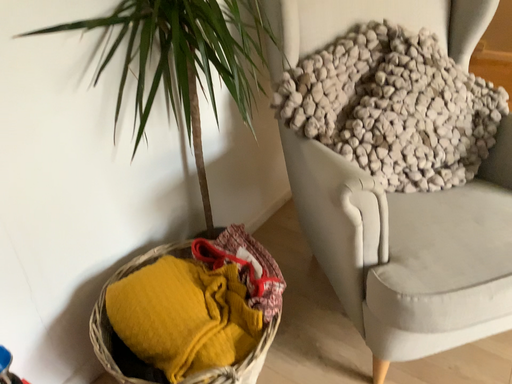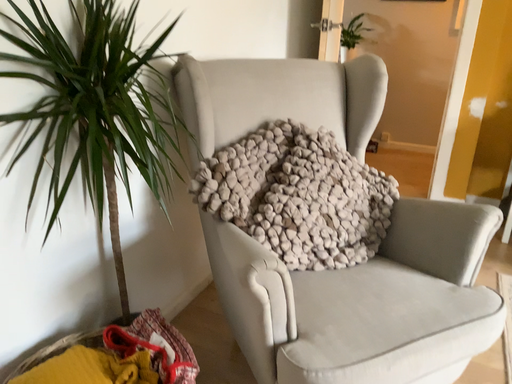
Question: Which way did the camera rotate in the video?

Choices:
 (A) rotated left
 (B) rotated right

Answer: (B)